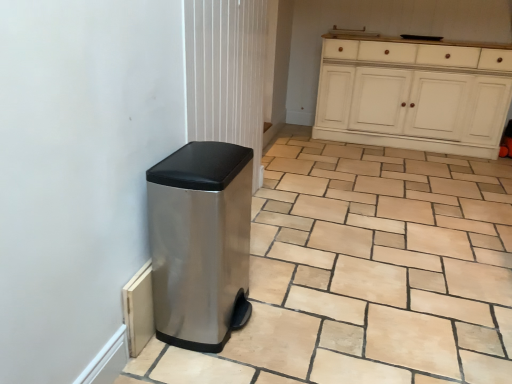
The height and width of the screenshot is (384, 512). In order to click on vacant area that is situated to the right of polished stainless steel trash can at lower left in this screenshot , I will do `click(296, 318)`.